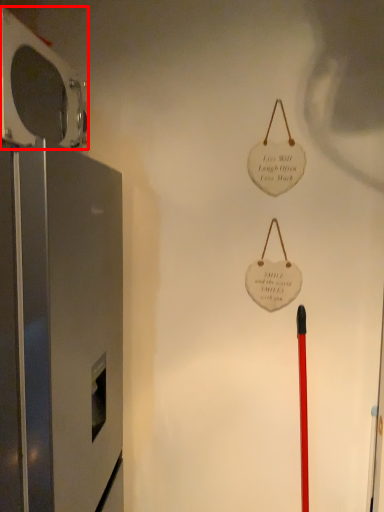
Question: In this image, where is appliance (annotated by the red box) located relative to appliance?

Choices:
 (A) right
 (B) left

Answer: (B)